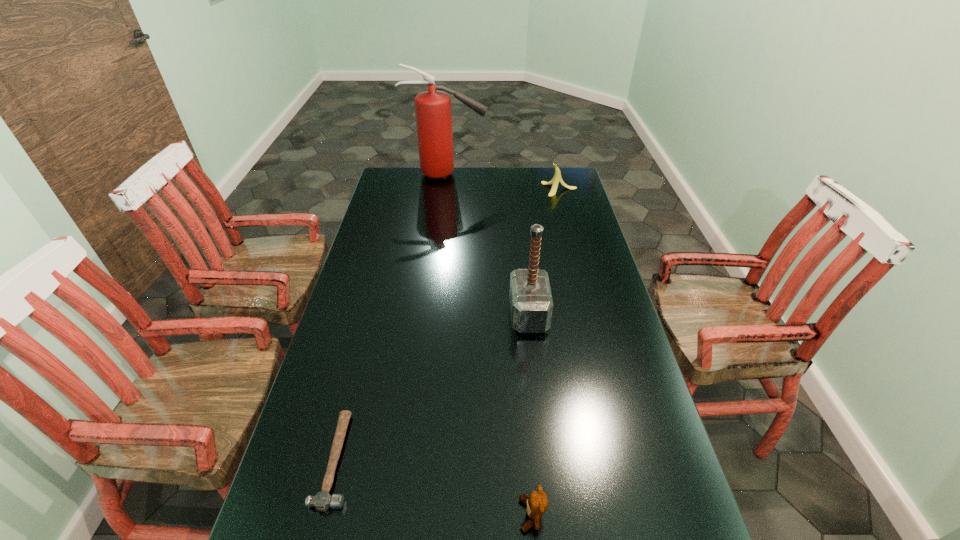
You are a GUI agent. You are given a task and a screenshot of the screen. Output one action in this format:
    pyautogui.click(x=<x>, y=<y>)
    Task: Click on the fire extinguisher
    This screenshot has width=960, height=540.
    Given the screenshot: What is the action you would take?
    pyautogui.click(x=433, y=111)

Where is `the farther hammer`? The height and width of the screenshot is (540, 960). the farther hammer is located at coordinates (531, 305).

The width and height of the screenshot is (960, 540). I want to click on the third farthest object, so click(531, 305).

What are the coordinates of `the rightmost object` in the screenshot? It's located at tap(557, 178).

You are a GUI agent. You are given a task and a screenshot of the screen. Output one action in this format:
    pyautogui.click(x=<x>, y=<y>)
    Task: Click on the third shortest object
    The image size is (960, 540).
    Given the screenshot: What is the action you would take?
    pyautogui.click(x=557, y=178)

You are a GUI agent. You are given a task and a screenshot of the screen. Output one action in this format:
    pyautogui.click(x=<x>, y=<y>)
    Task: Click on the teddy bear
    The image size is (960, 540).
    Given the screenshot: What is the action you would take?
    pyautogui.click(x=537, y=503)

The width and height of the screenshot is (960, 540). In order to click on the shorter hammer in this screenshot , I will do `click(322, 501)`.

Find the location of a particular element. The height and width of the screenshot is (540, 960). the nearer hammer is located at coordinates [x=322, y=501].

You are a GUI agent. You are given a task and a screenshot of the screen. Output one action in this format:
    pyautogui.click(x=<x>, y=<y>)
    Task: Click on the vacant point located at the nozzle of the tallest object
    The width and height of the screenshot is (960, 540).
    Given the screenshot: What is the action you would take?
    pyautogui.click(x=524, y=175)

This screenshot has width=960, height=540. What are the coordinates of `vacant space located 0.360m on the back of the farther hammer` in the screenshot? It's located at (519, 231).